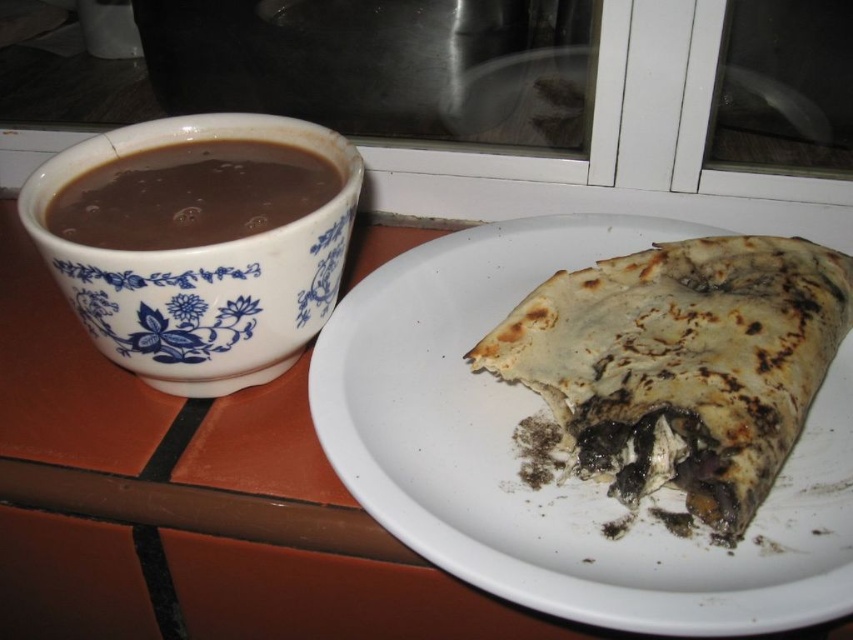
Question: Is burnt tortilla at plate right positioned at the back of blue porcelain mug at left?

Choices:
 (A) yes
 (B) no

Answer: (B)

Question: Which point is farther from the camera taking this photo?

Choices:
 (A) (756, 337)
 (B) (299, 212)

Answer: (B)

Question: Among these points, which one is farthest from the camera?

Choices:
 (A) (248, 220)
 (B) (664, 252)

Answer: (B)

Question: Does burnt tortilla at plate right appear on the right side of brown matte cup at left?

Choices:
 (A) no
 (B) yes

Answer: (B)

Question: Does blue porcelain mug at left have a larger size compared to brown matte cup at left?

Choices:
 (A) no
 (B) yes

Answer: (B)

Question: Which object is positioned closest to the blue porcelain mug at left?

Choices:
 (A) brown matte cup at left
 (B) burnt tortilla at plate right

Answer: (A)